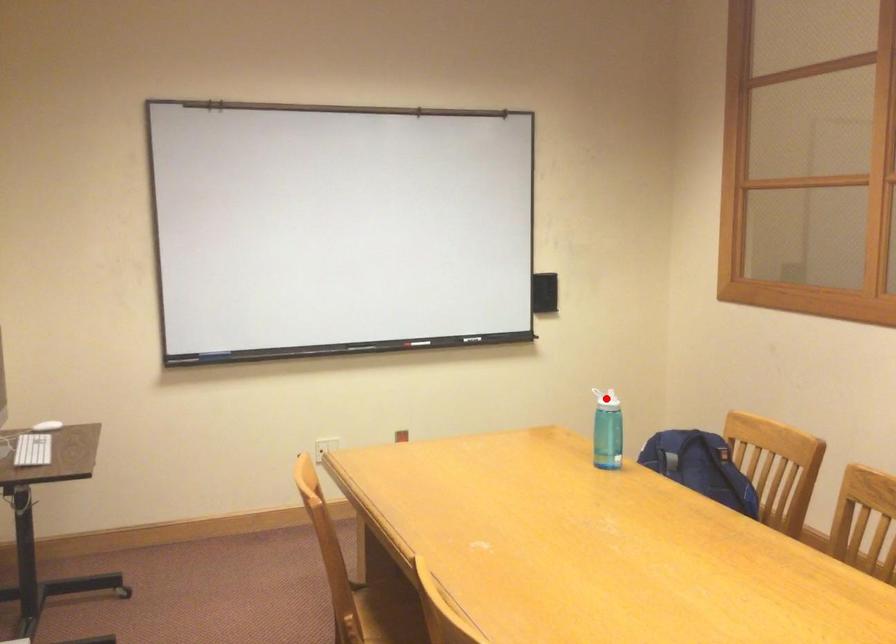
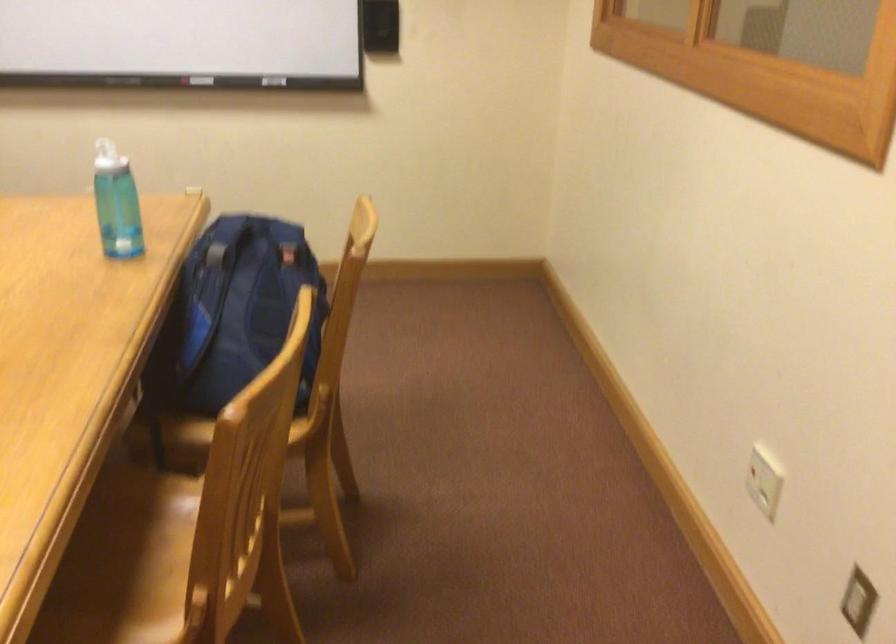
Question: I am providing you with two images of the same scene from different viewpoints. A red point is marked on the first image. Is the red point's position out of view in image 2?

Choices:
 (A) Yes
 (B) No

Answer: (A)